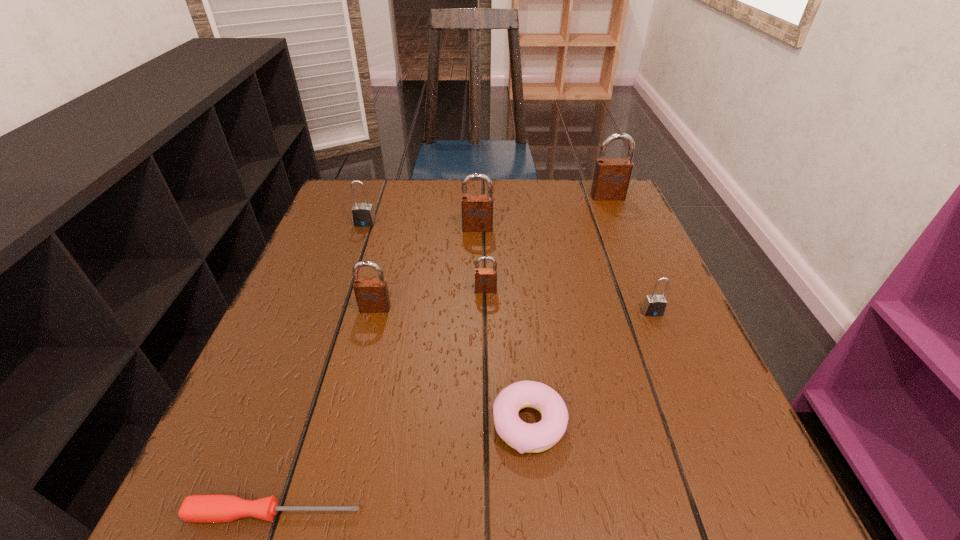
Point out which brown padlock is positioned as the second nearest to the seventh farthest object. Please provide its 2D coordinates. Your answer should be formatted as a tuple, i.e. [(x, y)], where the tuple contains the x and y coordinates of a point satisfying the conditions above.

[(372, 296)]

Where is `brown padlock that is the third closest one to the seventh farthest object`? The image size is (960, 540). brown padlock that is the third closest one to the seventh farthest object is located at coordinates (477, 209).

Locate an element on the screen. free spot that satisfies the following two spatial constraints: 1. on the front-facing side of the fifth shortest padlock; 2. on the left side of the seventh tallest object is located at coordinates (476, 424).

Locate an element on the screen. This screenshot has width=960, height=540. free space that satisfies the following two spatial constraints: 1. on the front-facing side of the doughnut; 2. on the right side of the second farthest brown padlock is located at coordinates (476, 424).